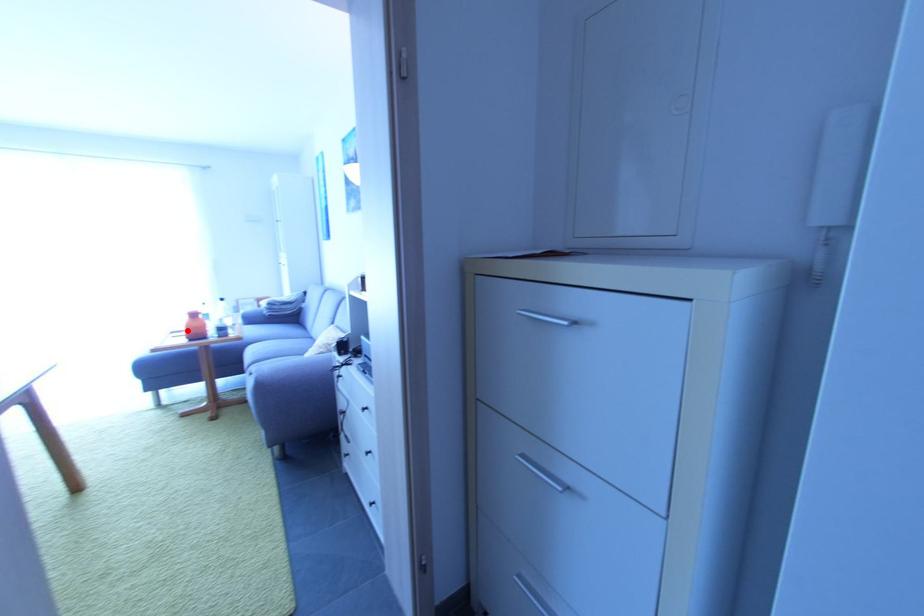
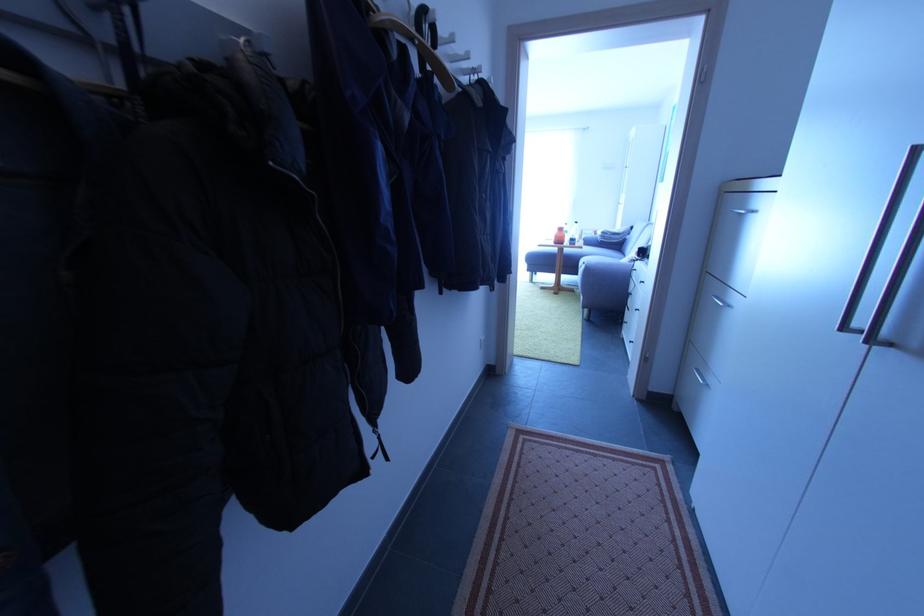
Question: I am providing you with two images of the same scene from different viewpoints. Image1 has a red point marked. In image2, the corresponding 3D location appears at what relative position? Reply with the corresponding letter.

Choices:
 (A) Closer
 (B) Farther

Answer: (A)